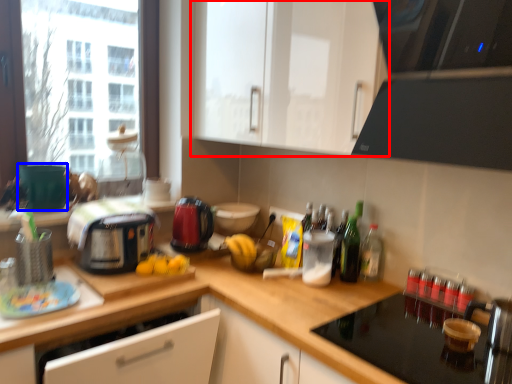
Question: Among these objects, which one is farthest to the camera, cabinetry (highlighted by a red box) or appliance (highlighted by a blue box)?

Choices:
 (A) cabinetry
 (B) appliance

Answer: (B)